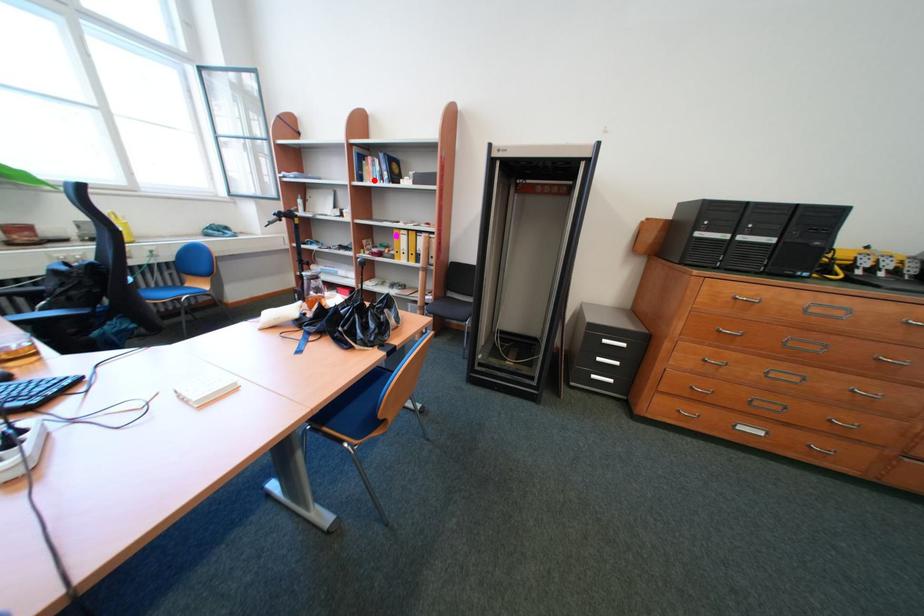
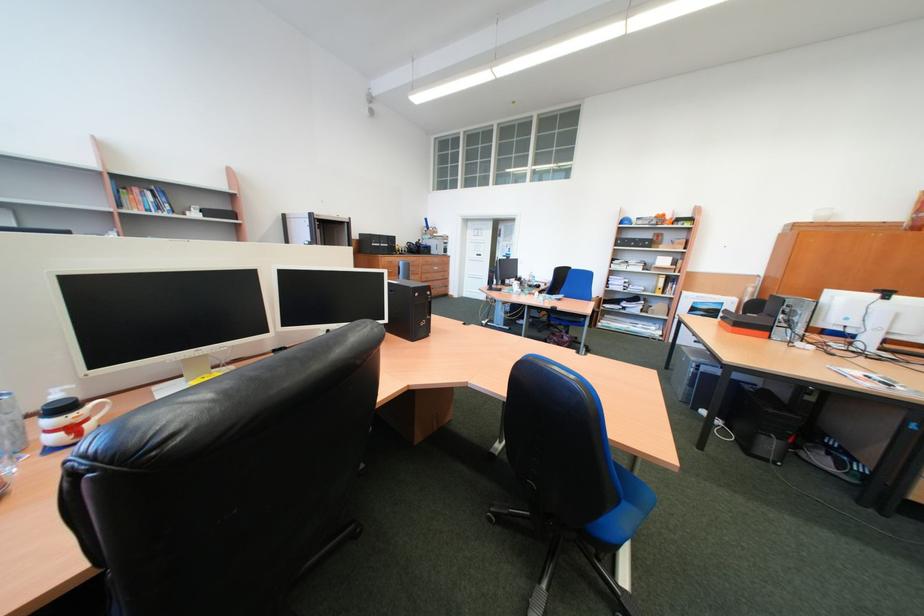
Where in the second image is the point corresponding to the highlighted location from the first image?

(134, 207)